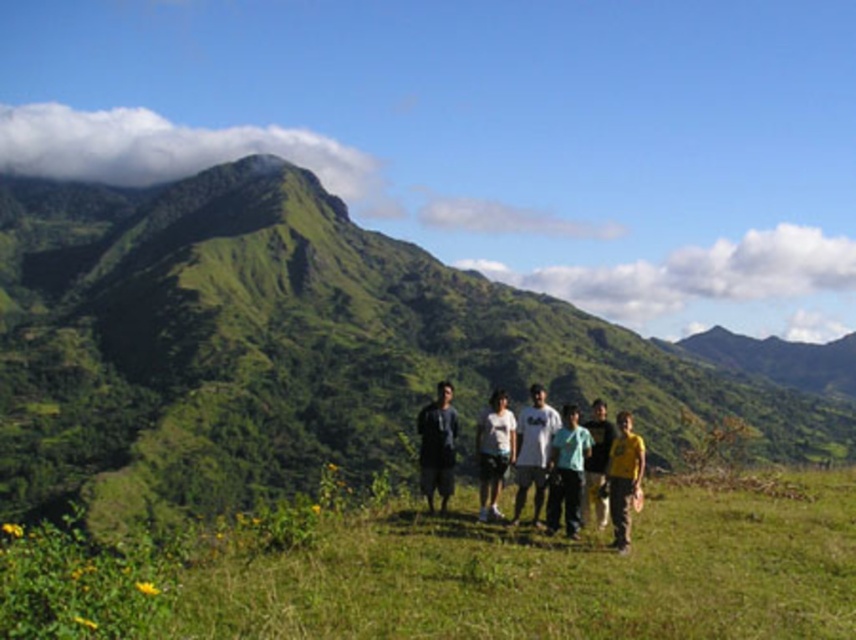
Question: Which is nearer to the white cotton shirt at center?

Choices:
 (A) matte black shirt at center
 (B) light blue shirt at center
 (C) yellow cotton shirt at center
 (D) white matte shirt at center

Answer: (B)

Question: Which of these objects is positioned closest to the yellow cotton shirt at center?

Choices:
 (A) green grassy mountain at center
 (B) green grassy field at center
 (C) light blue shirt at center
 (D) white matte shirt at center

Answer: (C)

Question: Is white cotton shirt at center smaller than yellow cotton shirt at center?

Choices:
 (A) no
 (B) yes

Answer: (A)

Question: Can you confirm if light blue t-shirt at center is positioned to the right of matte black shirt at center?

Choices:
 (A) no
 (B) yes

Answer: (B)

Question: Considering the relative positions of green grassy field at center and yellow cotton shirt at center in the image provided, where is green grassy field at center located with respect to yellow cotton shirt at center?

Choices:
 (A) left
 (B) right

Answer: (A)

Question: Which of the following is the closest to the observer?

Choices:
 (A) (720, 596)
 (B) (12, 355)

Answer: (A)